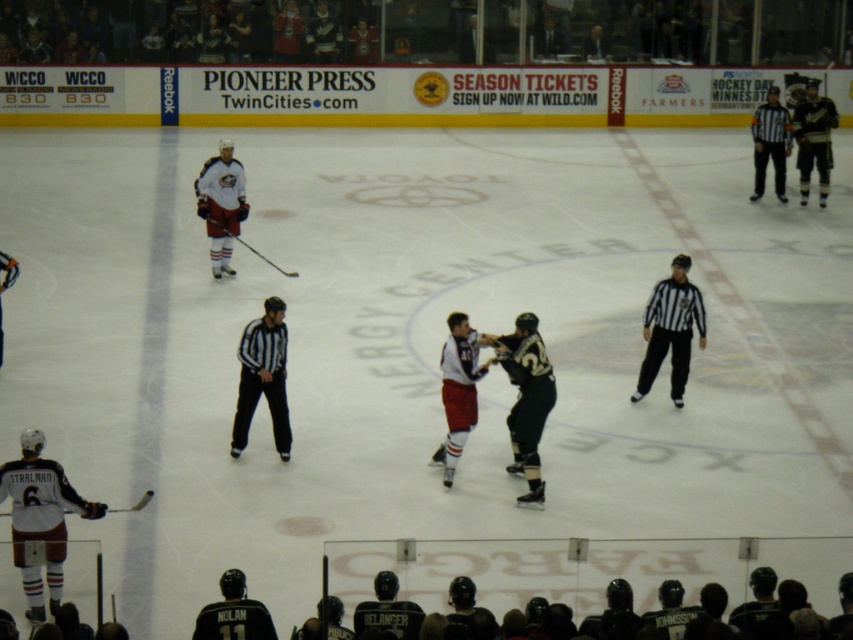
From the picture: Where is the white matte jersey at center located in the image?

The white matte jersey at center is located at point (x=221, y=204).

You are an ice hockey referee positioned at the center of the rink. You need to quickly assess the distance between the white jersey at lower left and the black jersey at center to determine if they are within the required 10 feet for a penalty. Can you enforce the penalty based on their current positions?

The distance between the white jersey at lower left and the black jersey at center is 11.30 feet, which exceeds the 10 feet requirement. Therefore, the penalty cannot be enforced as they are outside the required distance.